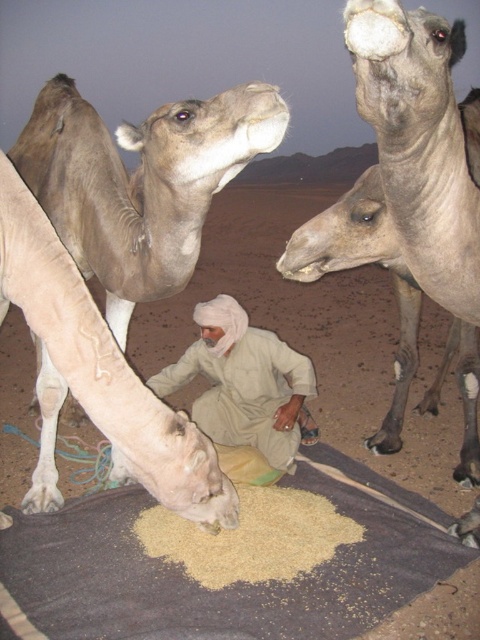
You are a traveler in the desert and see the light brown fur at center and the brown grain at lower center. Which object is bigger in size?

The light brown fur at center has a larger size compared to the brown grain at lower center.

You are a traveler in the desert and see the light beige cotton clothing at center and the brown grain at lower center. Which item is positioned higher in the image?

The light beige cotton clothing at center is located above the brown grain at lower center, so it is positioned higher in the image.

You are a traveler in the desert and you see the light brown fur at center and the brown grain at lower center. Which one is wider?

The light brown fur at center might be wider than brown grain at lower center according to the description.